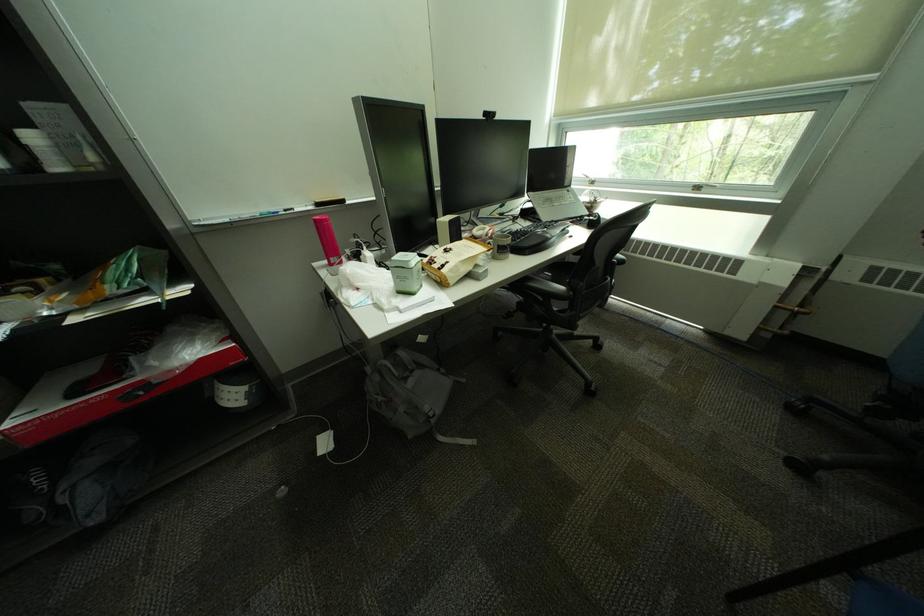
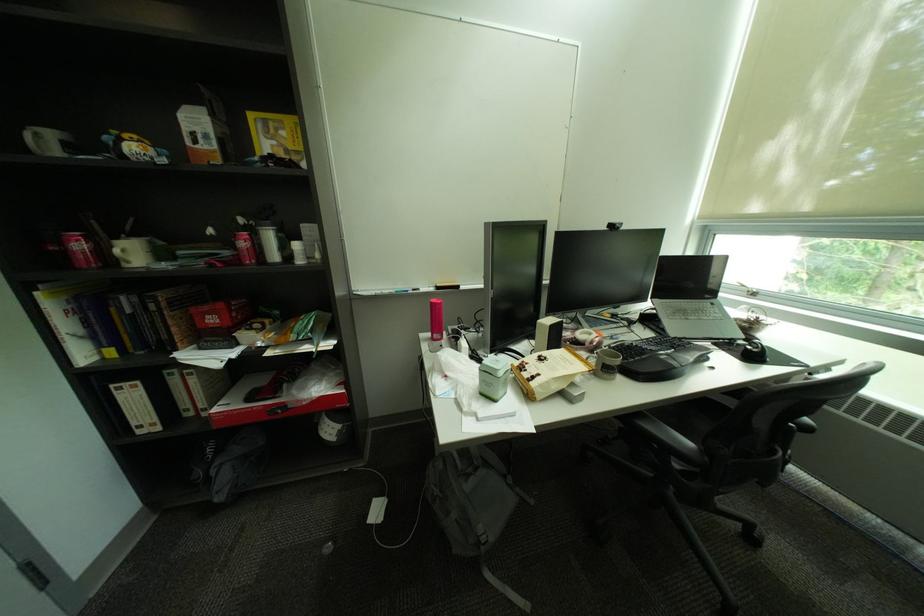
Where in the second image is the point corresponding to pixel 508 254 from the first image?

(613, 371)